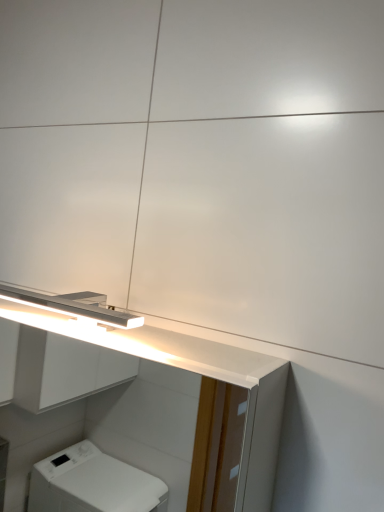
I want to click on satin nickel light fixture at upper left, so (73, 306).

Describe the element at coordinates (73, 306) in the screenshot. I see `satin nickel light fixture at upper left` at that location.

What is the approximate height of satin nickel light fixture at upper left?

satin nickel light fixture at upper left is 1.91 inches in height.

The width and height of the screenshot is (384, 512). What do you see at coordinates (150, 391) in the screenshot? I see `satin white cabinet at upper center` at bounding box center [150, 391].

Locate an element on the screen. This screenshot has height=512, width=384. satin white cabinet at upper center is located at coordinates (150, 391).

What is the approximate width of satin white cabinet at upper center?

The width of satin white cabinet at upper center is 14.33 centimeters.

The width and height of the screenshot is (384, 512). Find the location of `satin nickel light fixture at upper left`. satin nickel light fixture at upper left is located at coordinates (73, 306).

Can you confirm if satin white cabinet at upper center is positioned to the right of satin nickel light fixture at upper left?

Correct, you'll find satin white cabinet at upper center to the right of satin nickel light fixture at upper left.

Which object is closer to the camera, satin white cabinet at upper center or satin nickel light fixture at upper left?

satin white cabinet at upper center.

Which point is more forward, (x=257, y=403) or (x=24, y=300)?

The point (x=257, y=403) is closer to the camera.

From the image's perspective, between satin white cabinet at upper center and satin nickel light fixture at upper left, which one is located above?

From the image's view, satin nickel light fixture at upper left is above.

From a real-world perspective, is satin white cabinet at upper center physically above satin nickel light fixture at upper left?

Actually, satin white cabinet at upper center is physically below satin nickel light fixture at upper left in the real world.

From the picture: In terms of width, does satin white cabinet at upper center look wider or thinner when compared to satin nickel light fixture at upper left?

Considering their sizes, satin white cabinet at upper center looks broader than satin nickel light fixture at upper left.

Considering the sizes of satin white cabinet at upper center and satin nickel light fixture at upper left in the image, is satin white cabinet at upper center taller or shorter than satin nickel light fixture at upper left?

Clearly, satin white cabinet at upper center is taller compared to satin nickel light fixture at upper left.

Considering the sizes of objects satin white cabinet at upper center and satin nickel light fixture at upper left in the image provided, who is bigger, satin white cabinet at upper center or satin nickel light fixture at upper left?

Bigger between the two is satin white cabinet at upper center.

Is satin nickel light fixture at upper left located within satin white cabinet at upper center?

Yes, satin nickel light fixture at upper left is inside satin white cabinet at upper center.

Is satin white cabinet at upper center positioned far away from satin nickel light fixture at upper left?

Yes, satin white cabinet at upper center and satin nickel light fixture at upper left are located far from each other.

Is satin white cabinet at upper center facing away from satin nickel light fixture at upper left?

No, satin white cabinet at upper center's orientation is not away from satin nickel light fixture at upper left.

Measure the distance from satin white cabinet at upper center to satin nickel light fixture at upper left.

1.37 meters.

Locate an element on the screen. light fixture located on the left of satin white cabinet at upper center is located at coordinates (73, 306).

Based on their positions, is satin nickel light fixture at upper left located to the left or right of satin white cabinet at upper center?

Clearly, satin nickel light fixture at upper left is on the left of satin white cabinet at upper center in the image.

Between satin nickel light fixture at upper left and satin white cabinet at upper center, which one is positioned in front?

satin white cabinet at upper center is closer to the camera.

Considering the positions of points (12, 295) and (216, 366), is point (12, 295) farther from camera compared to point (216, 366)?

Yes, it is behind point (216, 366).

Consider the image. From the image's perspective, which one is positioned higher, satin nickel light fixture at upper left or satin white cabinet at upper center?

satin nickel light fixture at upper left, from the image's perspective.

From a real-world perspective, between satin nickel light fixture at upper left and satin white cabinet at upper center, who is vertically higher?

In real-world perspective, satin nickel light fixture at upper left is above.

Is satin nickel light fixture at upper left wider or thinner than satin white cabinet at upper center?

In the image, satin nickel light fixture at upper left appears to be more narrow than satin white cabinet at upper center.

Can you confirm if satin nickel light fixture at upper left is shorter than satin white cabinet at upper center?

Yes, satin nickel light fixture at upper left is shorter than satin white cabinet at upper center.

Who is bigger, satin nickel light fixture at upper left or satin white cabinet at upper center?

Bigger between the two is satin white cabinet at upper center.

Which is correct: satin nickel light fixture at upper left is inside satin white cabinet at upper center, or outside of it?

satin nickel light fixture at upper left lies within the bounds of satin white cabinet at upper center.

Are satin nickel light fixture at upper left and satin white cabinet at upper center beside each other?

satin nickel light fixture at upper left and satin white cabinet at upper center are not in contact.

Is satin nickel light fixture at upper left looking in the opposite direction of satin white cabinet at upper center?

Yes, satin white cabinet at upper center is at the back of satin nickel light fixture at upper left.

How many degrees apart are the facing directions of satin nickel light fixture at upper left and satin white cabinet at upper center?

There is a 0.0982-degree angle between the facing directions of satin nickel light fixture at upper left and satin white cabinet at upper center.

Measure the distance between satin nickel light fixture at upper left and satin white cabinet at upper center.

They are 4.49 feet apart.

Identify the location of bathroom cabinet to the right of satin nickel light fixture at upper left. point(150,391).

Where is `bathroom cabinet in front of the satin nickel light fixture at upper left`? The image size is (384, 512). bathroom cabinet in front of the satin nickel light fixture at upper left is located at coordinates (150, 391).

Where is `light fixture that appears behind the satin white cabinet at upper center`? This screenshot has height=512, width=384. light fixture that appears behind the satin white cabinet at upper center is located at coordinates (73, 306).